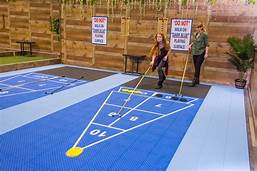
The image size is (257, 171). I want to click on signs on the backwall, so click(x=178, y=33), click(x=98, y=29).